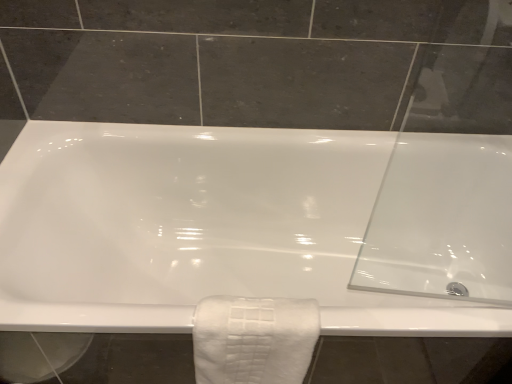
The height and width of the screenshot is (384, 512). I want to click on white textured towel at lower center, so click(x=254, y=339).

What is the approximate width of white textured towel at lower center?

The width of white textured towel at lower center is 7.23 inches.

Describe the element at coordinates (254, 339) in the screenshot. This screenshot has width=512, height=384. I see `white textured towel at lower center` at that location.

Describe the element at coordinates (199, 229) in the screenshot. I see `white glossy bathtub at center` at that location.

At what (x,y) coordinates should I click in order to perform the action: click on white glossy bathtub at center. Please return your answer as a coordinate pair (x, y). The height and width of the screenshot is (384, 512). Looking at the image, I should click on (199, 229).

Identify the location of white textured towel at lower center. This screenshot has height=384, width=512. pyautogui.click(x=254, y=339).

Between white textured towel at lower center and white glossy bathtub at center, which one appears on the left side from the viewer's perspective?

Positioned to the left is white textured towel at lower center.

Which object is further away from the camera, white textured towel at lower center or white glossy bathtub at center?

white glossy bathtub at center is further from the camera.

Which is in front, point (249, 351) or point (185, 147)?

The point (249, 351) is more forward.

From the image's perspective, between white textured towel at lower center and white glossy bathtub at center, who is located below?

From the image's view, white textured towel at lower center is below.

From a real-world perspective, relative to white glossy bathtub at center, is white textured towel at lower center vertically above or below?

From a real-world perspective, white textured towel at lower center is physically above white glossy bathtub at center.

Considering the sizes of white textured towel at lower center and white glossy bathtub at center in the image, is white textured towel at lower center wider or thinner than white glossy bathtub at center?

In the image, white textured towel at lower center appears to be more narrow than white glossy bathtub at center.

Which of these two, white textured towel at lower center or white glossy bathtub at center, stands shorter?

Standing shorter between the two is white textured towel at lower center.

Considering the sizes of objects white textured towel at lower center and white glossy bathtub at center in the image provided, who is bigger, white textured towel at lower center or white glossy bathtub at center?

Bigger between the two is white glossy bathtub at center.

Is white textured towel at lower center not inside white glossy bathtub at center?

No, most part of white textured towel at lower center lies within white glossy bathtub at center.

Is white textured towel at lower center positioned far away from white glossy bathtub at center?

They are positioned close to each other.

Is white textured towel at lower center oriented towards white glossy bathtub at center?

Yes, white textured towel at lower center is turned towards white glossy bathtub at center.

Can you tell me how much white textured towel at lower center and white glossy bathtub at center differ in facing direction?

0.503 degrees.

Locate an element on the screen. Image resolution: width=512 pixels, height=384 pixels. bathtub lying on the right of white textured towel at lower center is located at coordinates pyautogui.click(x=199, y=229).

Based on the photo, which object is positioned more to the left, white glossy bathtub at center or white textured towel at lower center?

Positioned to the left is white textured towel at lower center.

Which is behind, white glossy bathtub at center or white textured towel at lower center?

Positioned behind is white glossy bathtub at center.

Between point (35, 169) and point (309, 325), which one is positioned in front?

The point (309, 325) is closer to the camera.

From the image's perspective, between white glossy bathtub at center and white textured towel at lower center, which one is located above?

white glossy bathtub at center, from the image's perspective.

From a real-world perspective, is white glossy bathtub at center located beneath white textured towel at lower center?

Yes.

Which of these two, white glossy bathtub at center or white textured towel at lower center, is wider?

white glossy bathtub at center.

Considering the sizes of objects white glossy bathtub at center and white textured towel at lower center in the image provided, who is shorter, white glossy bathtub at center or white textured towel at lower center?

With less height is white textured towel at lower center.

In terms of size, does white glossy bathtub at center appear bigger or smaller than white textured towel at lower center?

Considering their sizes, white glossy bathtub at center takes up more space than white textured towel at lower center.

Would you say white textured towel at lower center is part of white glossy bathtub at center's contents?

Indeed, white textured towel at lower center is located within white glossy bathtub at center.

Are white glossy bathtub at center and white textured towel at lower center beside each other?

They are not placed beside each other.

Does white glossy bathtub at center turn towards white textured towel at lower center?

Yes, white glossy bathtub at center faces towards white textured towel at lower center.

What's the angular difference between white glossy bathtub at center and white textured towel at lower center's facing directions?

white glossy bathtub at center and white textured towel at lower center are facing 0.503 degrees away from each other.

How far apart are white glossy bathtub at center and white textured towel at lower center?

A distance of 14.36 inches exists between white glossy bathtub at center and white textured towel at lower center.

The height and width of the screenshot is (384, 512). In order to click on bathtub behind the white textured towel at lower center in this screenshot , I will do `click(199, 229)`.

At what (x,y) coordinates should I click in order to perform the action: click on bathtub behind the white textured towel at lower center. Please return your answer as a coordinate pair (x, y). The width and height of the screenshot is (512, 384). Looking at the image, I should click on (199, 229).

I want to click on bathtub below the white textured towel at lower center (from a real-world perspective), so click(x=199, y=229).